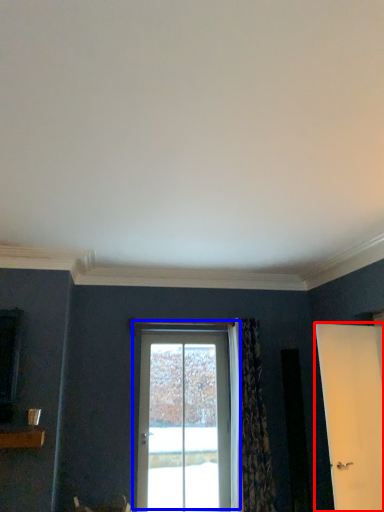
Question: Among these objects, which one is farthest to the camera, door (highlighted by a red box) or door (highlighted by a blue box)?

Choices:
 (A) door
 (B) door

Answer: (B)